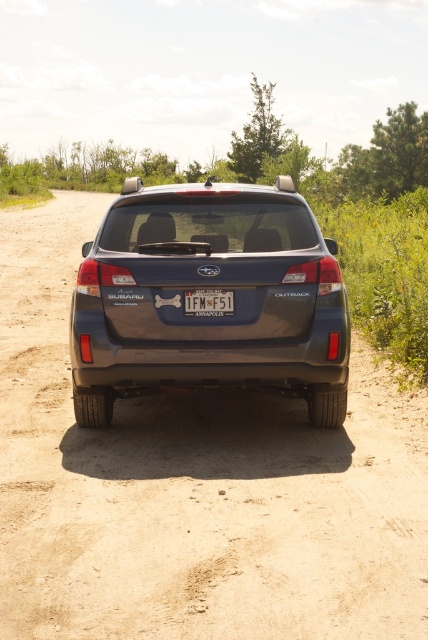
Does dirtloose sand at center have a lesser height compared to satin metallic suv at center?

Incorrect, dirtloose sand at center's height does not fall short of satin metallic suv at center's.

Does dirtloose sand at center have a greater width compared to satin metallic suv at center?

Indeed, dirtloose sand at center has a greater width compared to satin metallic suv at center.

What do you see at coordinates (193, 486) in the screenshot? The image size is (428, 640). I see `dirtloose sand at center` at bounding box center [193, 486].

Find the location of a particular element. Image resolution: width=428 pixels, height=640 pixels. dirtloose sand at center is located at coordinates (193, 486).

How distant is dirtloose sand at center from white plastic license plate at center?

A distance of 6.40 feet exists between dirtloose sand at center and white plastic license plate at center.

Can you confirm if dirtloose sand at center is positioned to the left of white plastic license plate at center?

Indeed, dirtloose sand at center is positioned on the left side of white plastic license plate at center.

The image size is (428, 640). What are the coordinates of `dirtloose sand at center` in the screenshot? It's located at (193, 486).

Who is shorter, satin metallic suv at center or white plastic license plate at center?

With less height is white plastic license plate at center.

Which is in front, point (323, 385) or point (205, 301)?

Point (205, 301)

This screenshot has width=428, height=640. In order to click on satin metallic suv at center in this screenshot , I will do `click(208, 289)`.